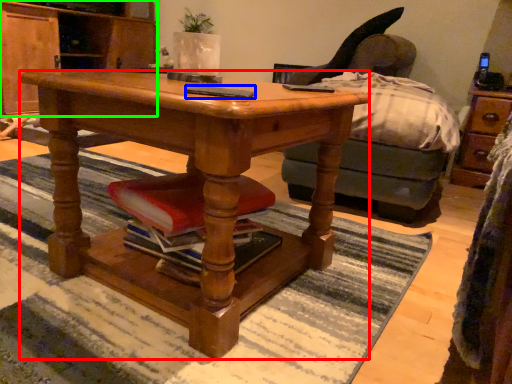
Question: Which is nearer to the desk (highlighted by a red box)? mobile phone (highlighted by a blue box) or cabinetry (highlighted by a green box).

Choices:
 (A) mobile phone
 (B) cabinetry

Answer: (A)